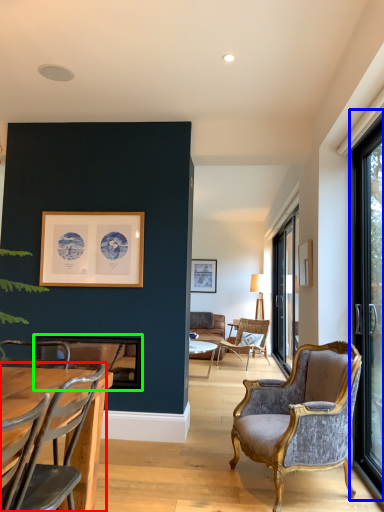
Question: Which object is the closest to the chair (highlighted by a red box)? Choose among these: window (highlighted by a blue box) or picture frame (highlighted by a green box).

Choices:
 (A) window
 (B) picture frame

Answer: (B)